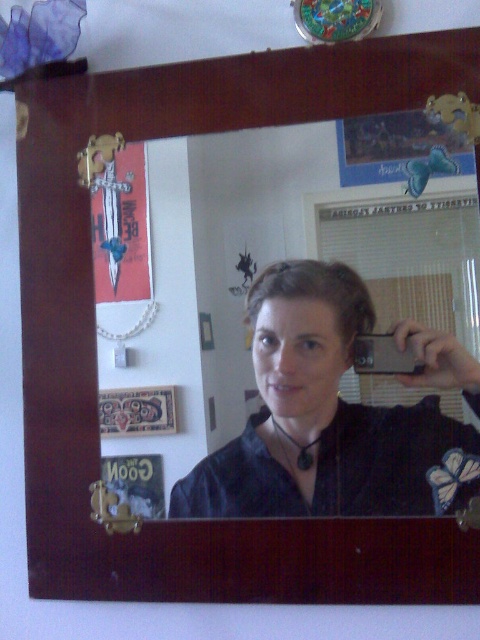
Question: In this image, where is matte black shirt at center located relative to wooden picture frame at lower left?

Choices:
 (A) below
 (B) above

Answer: (B)

Question: Is matte black shirt at center thinner than wooden picture frame at lower left?

Choices:
 (A) yes
 (B) no

Answer: (B)

Question: Does matte black shirt at center appear under wooden picture frame at lower left?

Choices:
 (A) no
 (B) yes

Answer: (A)

Question: Which of the following is the farthest from the observer?

Choices:
 (A) (444, 440)
 (B) (136, 433)

Answer: (B)